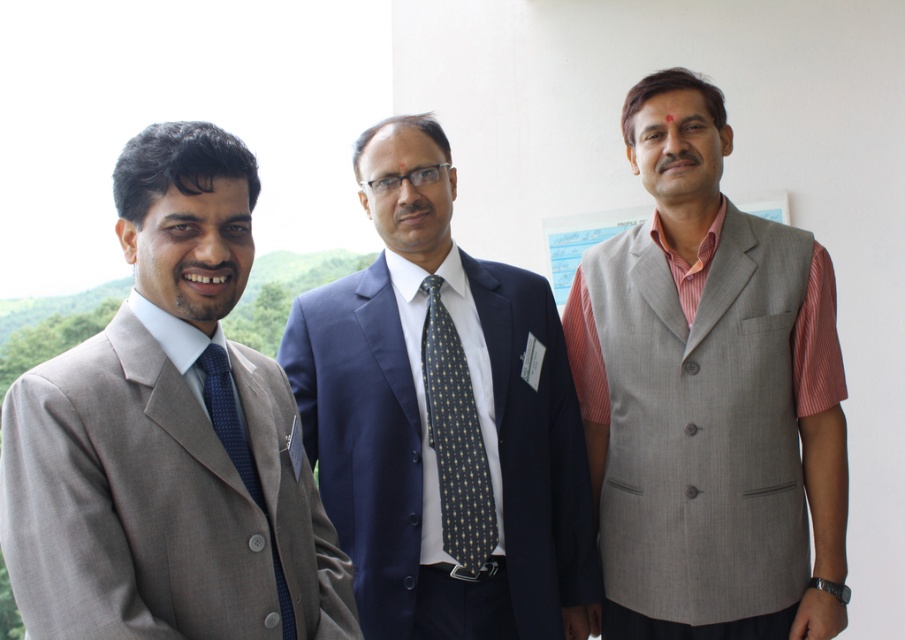
Question: Does light gray woolen vest at right have a larger size compared to matte blue suit at center?

Choices:
 (A) no
 (B) yes

Answer: (B)

Question: Is matte gray suit at left closer to camera compared to blue paper at center?

Choices:
 (A) yes
 (B) no

Answer: (A)

Question: Considering the real-world distances, which object is farthest from the matte gray suit at left?

Choices:
 (A) blue paper at center
 (B) light gray woolen vest at right

Answer: (A)

Question: Which point appears closest to the camera in this image?

Choices:
 (A) (602, 221)
 (B) (770, 605)

Answer: (B)

Question: Which point is closer to the camera?

Choices:
 (A) dark blue textured tie at center
 (B) blue paper at center

Answer: (A)

Question: Can you confirm if matte gray suit at left is positioned below blue paper at center?

Choices:
 (A) no
 (B) yes

Answer: (B)